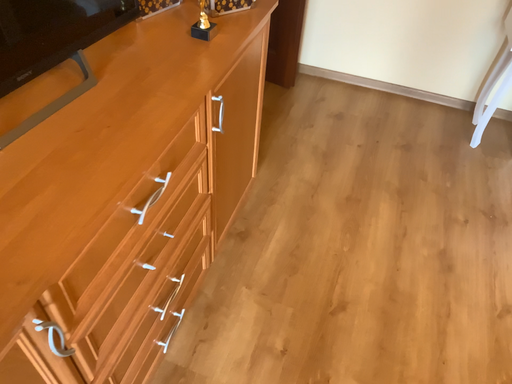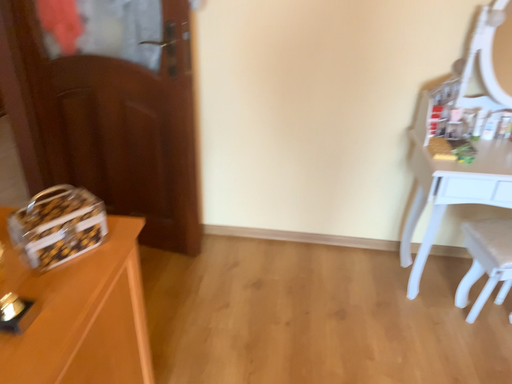
Question: Which way did the camera rotate in the video?

Choices:
 (A) rotated right
 (B) rotated left

Answer: (A)